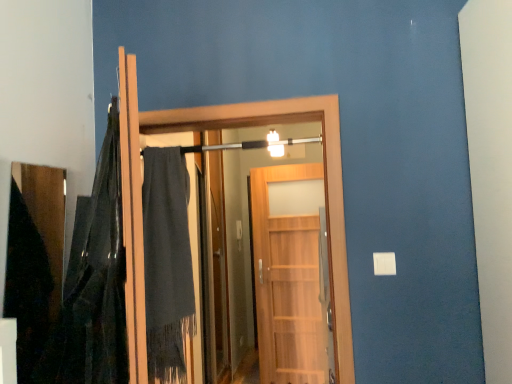
Question: From a real-world perspective, is dark gray woolen robe at center physically located above or below wooden door at center, marked as the 1th door in a back-to-front arrangement?

Choices:
 (A) above
 (B) below

Answer: (A)

Question: Which is correct: dark gray woolen robe at center is inside wooden door at center, marked as the 1th door in a back-to-front arrangement, or outside of it?

Choices:
 (A) inside
 (B) outside

Answer: (B)

Question: Which is nearer to the velvet dark gray blanket at left?

Choices:
 (A) wooden door at center, which is the 2th door from back to front
 (B) wooden door at center, marked as the 1th door in a back-to-front arrangement
 (C) dark gray woolen robe at center

Answer: (C)

Question: Based on their relative distances, which object is farther from the wooden door at center, which is the 2th door from back to front?

Choices:
 (A) velvet dark gray blanket at left
 (B) wooden door at center, marked as the 2th door in a front-to-back arrangement
 (C) dark gray woolen robe at center

Answer: (B)